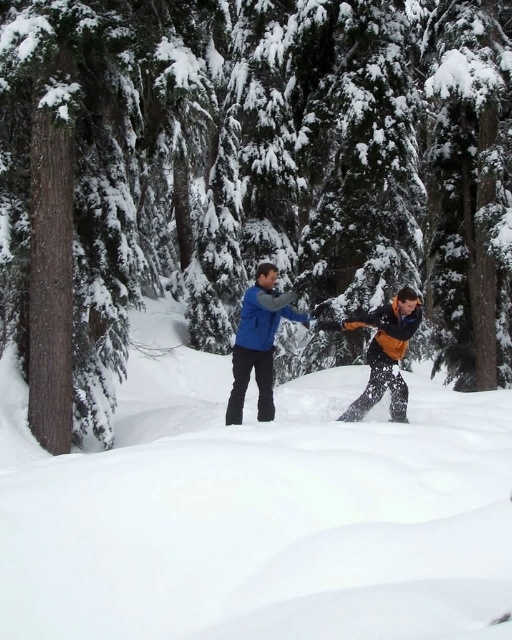
You are navigating a drone through a snowy forest scene. The drone must avoid the brown textured trunk at center. What are the coordinates to steer the drone around the trunk?

The brown textured trunk at center is located at coordinates point [245,176]. To steer the drone around it, you should adjust the path to avoid this point.

You are standing in the snowy forest and want to take a photo of the white fluffy snow at center. Where should you aim your camera to capture it?

You should aim your camera at point (259, 513) to capture the white fluffy snow at center.